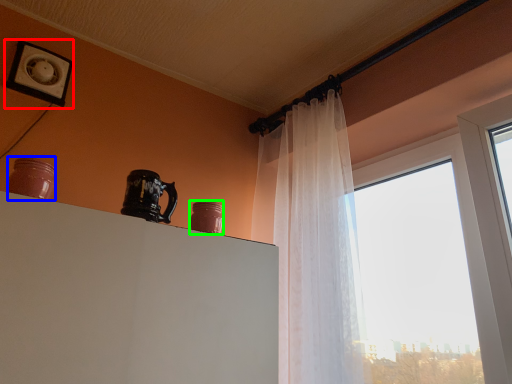
Question: Which object is positioned farthest from picture frame (highlighted by a red box)? Select from pottery (highlighted by a blue box) and pottery (highlighted by a green box).

Choices:
 (A) pottery
 (B) pottery

Answer: (B)